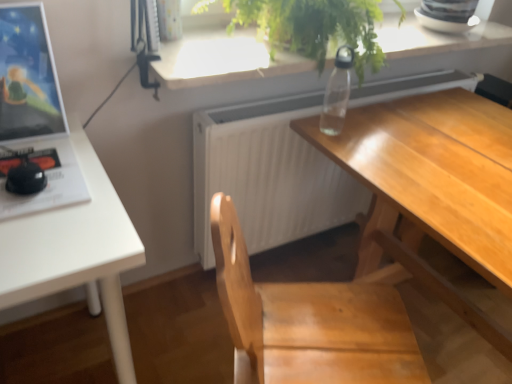
Question: Is white matte table at left wider or thinner than wooden desk at center?

Choices:
 (A) thin
 (B) wide

Answer: (B)

Question: In terms of height, does white matte table at left look taller or shorter compared to wooden desk at center?

Choices:
 (A) tall
 (B) short

Answer: (B)

Question: Based on their relative distances, which object is nearer to the transparent plastic bottle at upper center?

Choices:
 (A) white matte table at left
 (B) white matte radiator at center
 (C) matte black monitor at left
 (D) green leafy plant at upper center
 (E) wooden desk at center

Answer: (D)

Question: Considering the real-world distances, which object is closest to the matte black monitor at left?

Choices:
 (A) green leafy plant at upper center
 (B) white matte table at left
 (C) transparent plastic bottle at upper center
 (D) white matte radiator at center
 (E) wooden desk at center

Answer: (B)